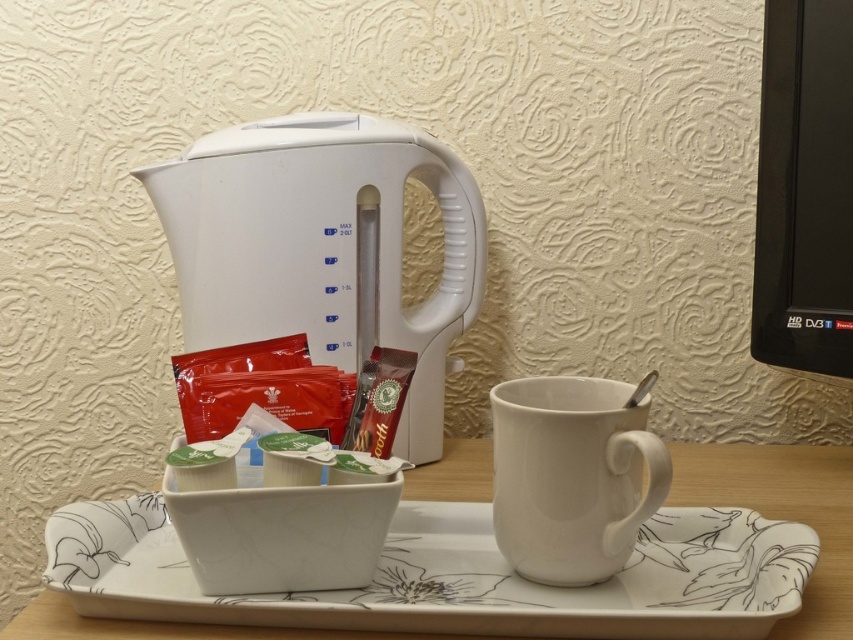
Question: Is white plastic kettle at upper center below white ceramic mug at lower center?

Choices:
 (A) yes
 (B) no

Answer: (B)

Question: Based on their relative distances, which object is nearer to the white ceramic tray at center?

Choices:
 (A) black plastic monitor at upper right
 (B) white plastic kettle at upper center
 (C) white ceramic mug at lower center

Answer: (C)

Question: Does white ceramic tray at center come behind white ceramic mug at lower center?

Choices:
 (A) no
 (B) yes

Answer: (A)

Question: Which object is positioned farthest from the white ceramic tray at center?

Choices:
 (A) white ceramic mug at lower center
 (B) white plastic kettle at upper center
 (C) black plastic monitor at upper right

Answer: (C)

Question: Which object appears closest to the camera in this image?

Choices:
 (A) white ceramic mug at lower center
 (B) white ceramic tray at center

Answer: (B)

Question: Does white plastic kettle at upper center have a greater width compared to white ceramic tray at center?

Choices:
 (A) yes
 (B) no

Answer: (B)